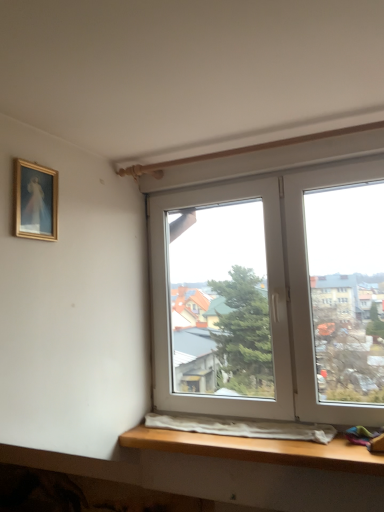
Describe the element at coordinates (35, 201) in the screenshot. I see `gold-framed painting at upper left` at that location.

Where is `gold-framed painting at upper left`? gold-framed painting at upper left is located at coordinates (35, 201).

What is the approximate height of gold-framed painting at upper left?

gold-framed painting at upper left is 10.67 inches tall.

Where is `gold-framed painting at upper left`? gold-framed painting at upper left is located at coordinates (35, 201).